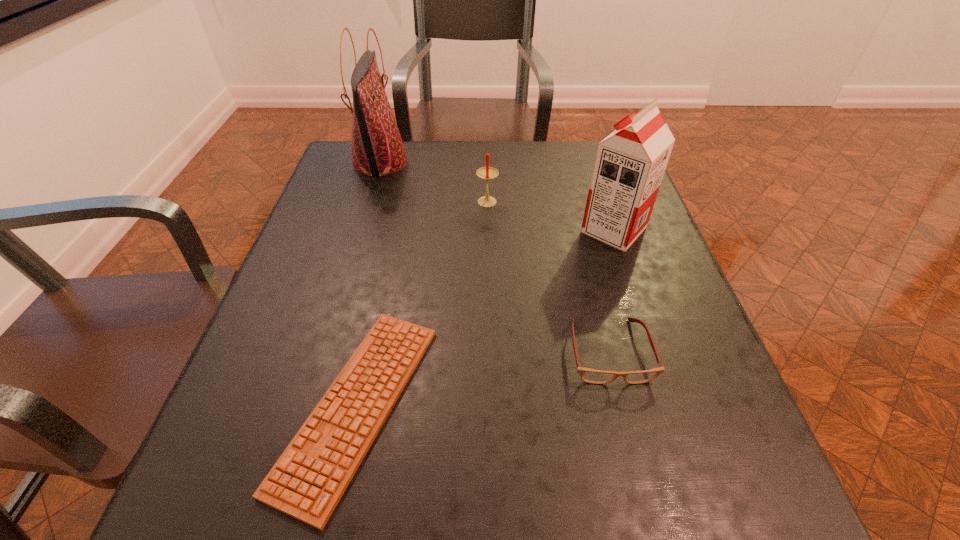
I want to click on the farthest object, so click(377, 148).

The height and width of the screenshot is (540, 960). I want to click on the fourth shortest object, so click(630, 163).

The image size is (960, 540). Identify the location of candle. (487, 173).

The image size is (960, 540). I want to click on the third shortest object, so click(487, 173).

Identify the location of the second shortest object. (588, 375).

The height and width of the screenshot is (540, 960). I want to click on the shortest object, so click(x=308, y=480).

Where is `free location located 0.380m on the right of the farthest object`? free location located 0.380m on the right of the farthest object is located at coordinates (546, 162).

Identify the location of free region located on the back of the soya milk. The width and height of the screenshot is (960, 540). (585, 145).

Locate an element on the screen. Image resolution: width=960 pixels, height=540 pixels. free space located on the right of the third object from left to right is located at coordinates (585, 204).

Where is `vacant area situated 0.080m on the front-facing side of the spectacles`? vacant area situated 0.080m on the front-facing side of the spectacles is located at coordinates (629, 435).